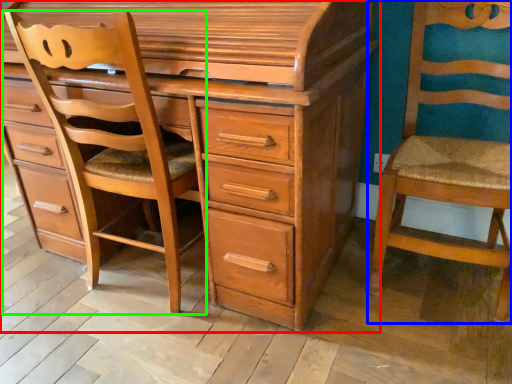
Question: Which object is positioned farthest from chest of drawers (highlighted by a red box)? Select from chair (highlighted by a blue box) and furniture (highlighted by a green box).

Choices:
 (A) chair
 (B) furniture

Answer: (A)